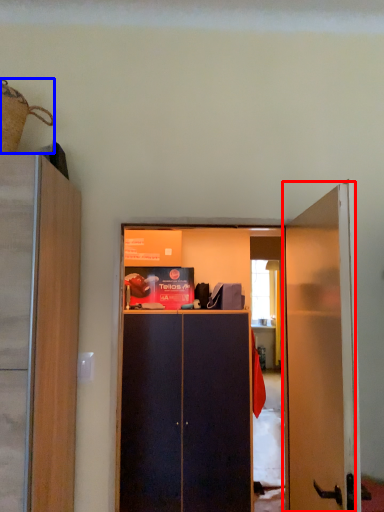
Question: Which object appears closest to the camera in this image, door (highlighted by a red box) or houseplant (highlighted by a blue box)?

Choices:
 (A) door
 (B) houseplant

Answer: (A)